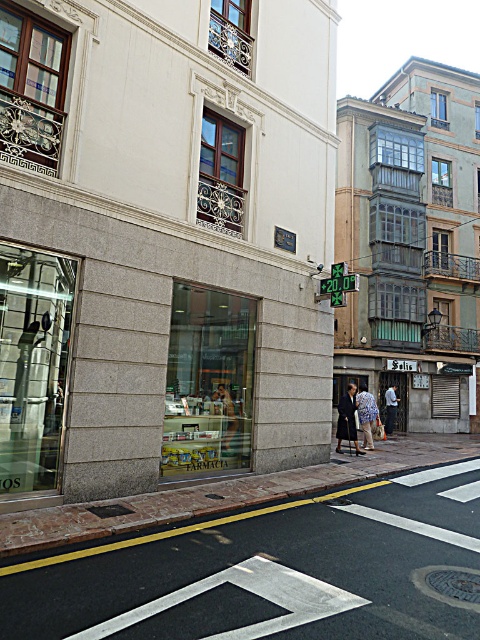
You are a delivery person trying to deliver a package to the granite storefront at center. You see a dark gray coat at center in your way. Can you pass through the space between them?

The granite storefront at center is bigger than dark gray coat at center, but since the dark gray coat at center is an object carried by a person, it is likely moveable. You can ask the person to step aside or wait until they move to deliver the package to the granite storefront at center.

You are a delivery person who needs to place a package between the blue floral dress at center and the dark blue jeans at center. The package requires a minimum of 15 feet of space. Can you fit it there?

The blue floral dress at center and dark blue jeans at center are 16.24 feet apart, which is more than the required 15 feet, so yes, the package can be placed between them.

You are standing at the crosswalk on the street. You want to find the granite storefront at center. According to the coordinates provided, where should you look relative to the crosswalk?

The granite storefront at center is located at coordinates point (164,241), which places it on the building wall near the crosswalk on the street.